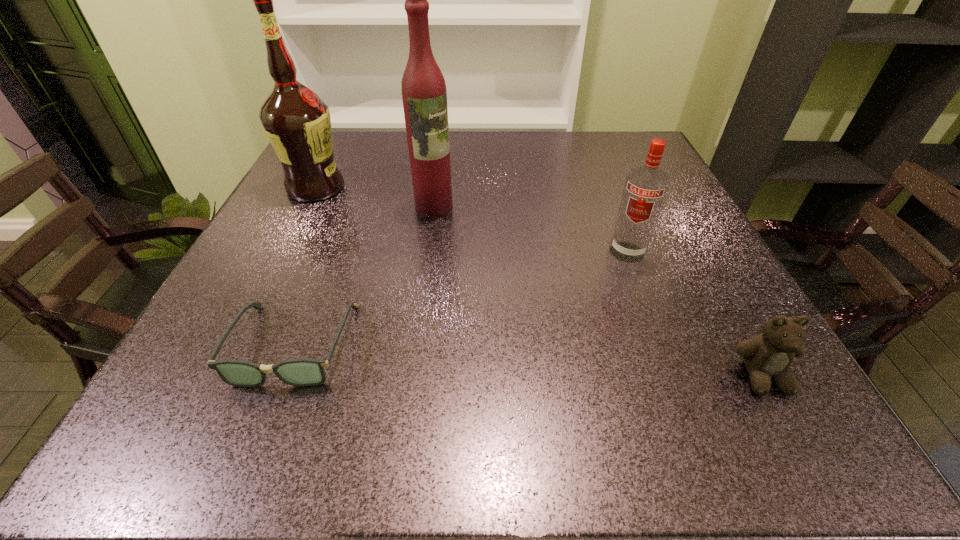
This screenshot has width=960, height=540. In the image, there is a desktop. Find the location of `vacant space at the far left corner`. vacant space at the far left corner is located at coordinates (348, 141).

Where is `free region at the near left corner`? free region at the near left corner is located at coordinates (227, 344).

Locate an element on the screen. The height and width of the screenshot is (540, 960). vacant area at the near right corner of the desktop is located at coordinates (682, 347).

Where is `free space between the teddy bear and the liquor`? Image resolution: width=960 pixels, height=540 pixels. free space between the teddy bear and the liquor is located at coordinates coord(598,292).

At what (x,y) coordinates should I click in order to perform the action: click on empty space that is in between the teddy bear and the liquor. Please return your answer as a coordinate pair (x, y). The image size is (960, 540). Looking at the image, I should click on (598, 292).

Identify the location of free point between the liquor and the fourth object from left to right. (531, 230).

Image resolution: width=960 pixels, height=540 pixels. I want to click on vacant space that's between the third shortest object and the teddy bear, so click(695, 314).

Identify the location of free space between the shortest object and the liquor. (364, 276).

At what (x,y) coordinates should I click in order to perform the action: click on vacant point located between the alcohol and the fourth object from left to right. Please return your answer as a coordinate pair (x, y). The width and height of the screenshot is (960, 540). Looking at the image, I should click on (471, 220).

This screenshot has width=960, height=540. Identify the location of vacant area that lies between the teddy bear and the liquor. (598, 292).